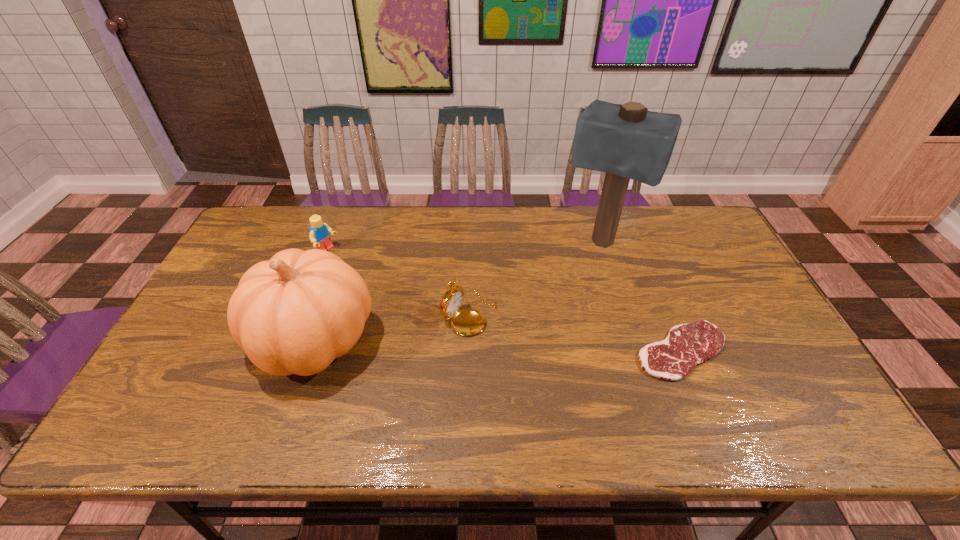
I want to click on free region located on the front-facing side of the Lego, so click(x=369, y=275).

The width and height of the screenshot is (960, 540). In order to click on vacant space located on the front-facing side of the Lego in this screenshot , I will do `click(350, 265)`.

What are the coordinates of `vacant space located 0.090m on the front-facing side of the Lego` in the screenshot? It's located at (354, 267).

The image size is (960, 540). I want to click on free location located 0.210m on the face of the pocket watch, so click(x=564, y=361).

Locate an element on the screen. Image resolution: width=960 pixels, height=540 pixels. vacant space positioned 0.350m on the face of the pocket watch is located at coordinates (617, 388).

In order to click on vacant space situated 0.170m on the face of the pocket watch in this screenshot , I will do `click(549, 354)`.

Locate an element on the screen. This screenshot has height=540, width=960. mallet situated at the far edge is located at coordinates [x=627, y=141].

This screenshot has height=540, width=960. What are the coordinates of `Lego situated at the far edge` in the screenshot? It's located at (319, 235).

The height and width of the screenshot is (540, 960). Find the location of `pumpkin located in the near edge section of the desktop`. pumpkin located in the near edge section of the desktop is located at coordinates (293, 314).

At what (x,y) coordinates should I click in order to perform the action: click on steak that is positioned at the near edge. Please return your answer as a coordinate pair (x, y). The height and width of the screenshot is (540, 960). Looking at the image, I should click on (686, 345).